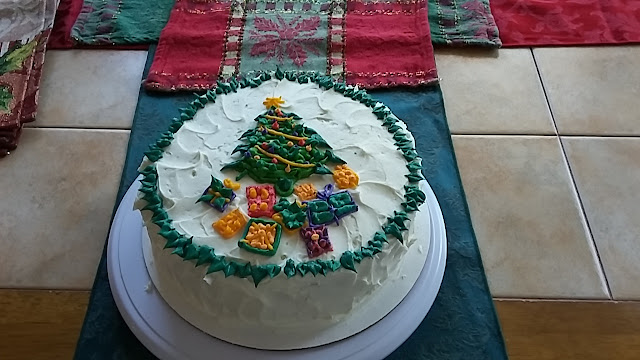
Locate an element on the screen. The width and height of the screenshot is (640, 360). christmas tree made out of icing is located at coordinates (284, 179), (248, 160), (278, 149), (294, 138), (272, 101), (298, 123).